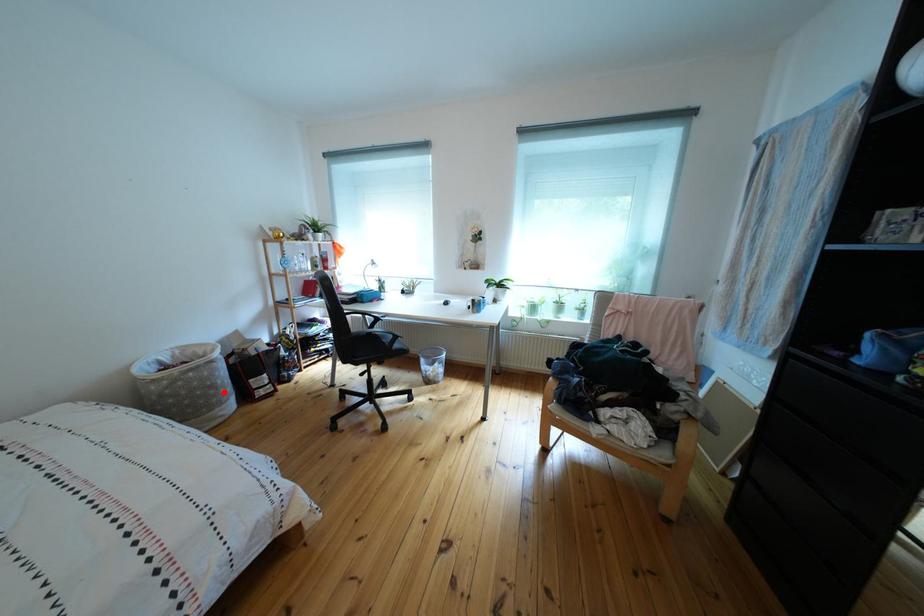
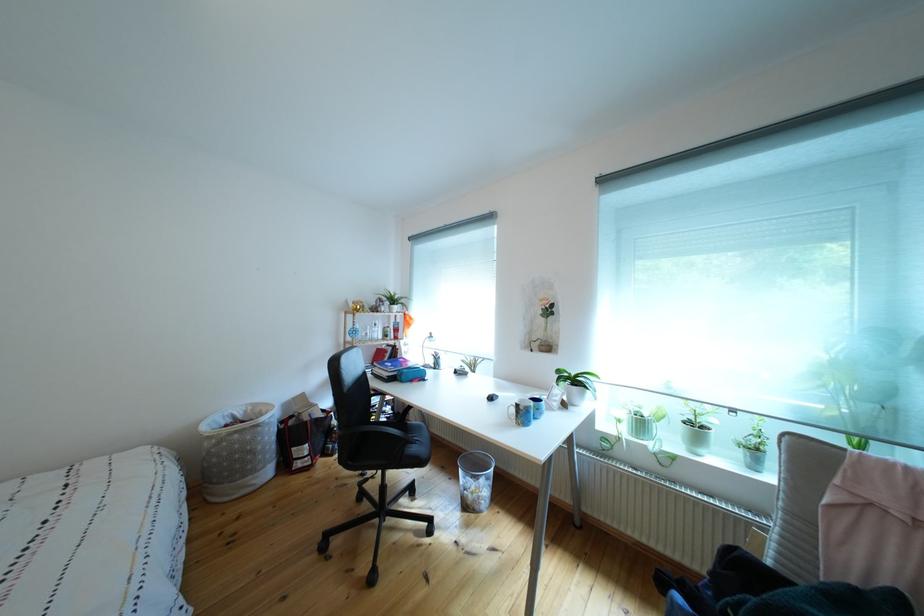
Question: I am providing you with two images of the same scene from different viewpoints. In image1, a red point is highlighted. Considering the same 3D point in image2, which of the following is correct?

Choices:
 (A) It is closer
 (B) It is farther

Answer: (B)